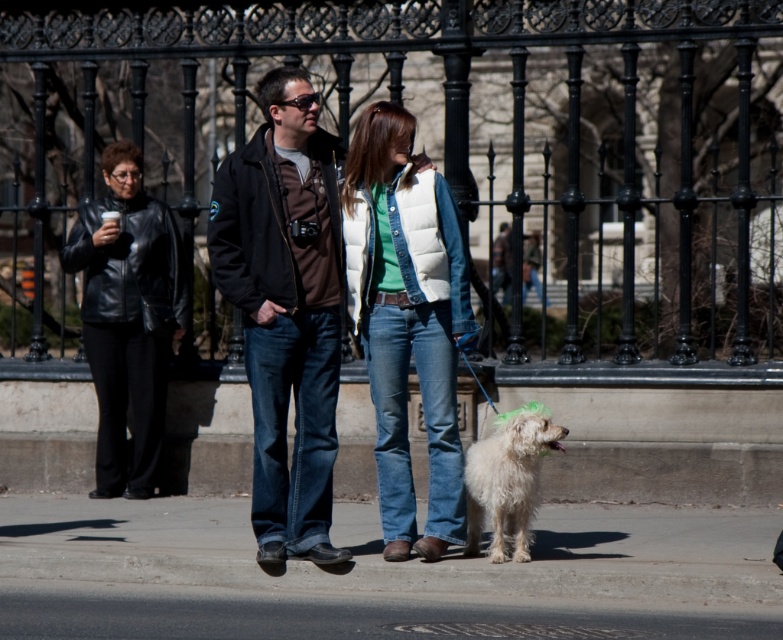
Between dark brown leather jacket at center and white fluffy dog at lower right, which one appears on the left side from the viewer's perspective?

Positioned to the left is dark brown leather jacket at center.

Does dark brown leather jacket at center have a lesser width compared to white fluffy dog at lower right?

Incorrect, dark brown leather jacket at center's width is not less than white fluffy dog at lower right's.

The image size is (783, 640). Describe the element at coordinates (287, 308) in the screenshot. I see `dark brown leather jacket at center` at that location.

Find the location of a particular element. dark brown leather jacket at center is located at coordinates (287, 308).

Who is positioned more to the right, white puffy vest at center or black leather jacket at left?

Positioned to the right is white puffy vest at center.

Who is positioned more to the left, white puffy vest at center or black leather jacket at left?

Positioned to the left is black leather jacket at left.

Is point (442, 365) positioned in front of point (114, 289)?

Yes, point (442, 365) is in front of point (114, 289).

Find the location of a particular element. Image resolution: width=783 pixels, height=640 pixels. white puffy vest at center is located at coordinates (406, 321).

Is gray concrete pavement at lower center positioned in front of white fluffy dog at lower right?

Yes.

Does gray concrete pavement at lower center have a lesser width compared to white fluffy dog at lower right?

Incorrect, gray concrete pavement at lower center's width is not less than white fluffy dog at lower right's.

You are a GUI agent. You are given a task and a screenshot of the screen. Output one action in this format:
    pyautogui.click(x=<x>, y=<y>)
    Task: Click on the gray concrete pavement at lower center
    
    Given the screenshot: What is the action you would take?
    pyautogui.click(x=381, y=576)